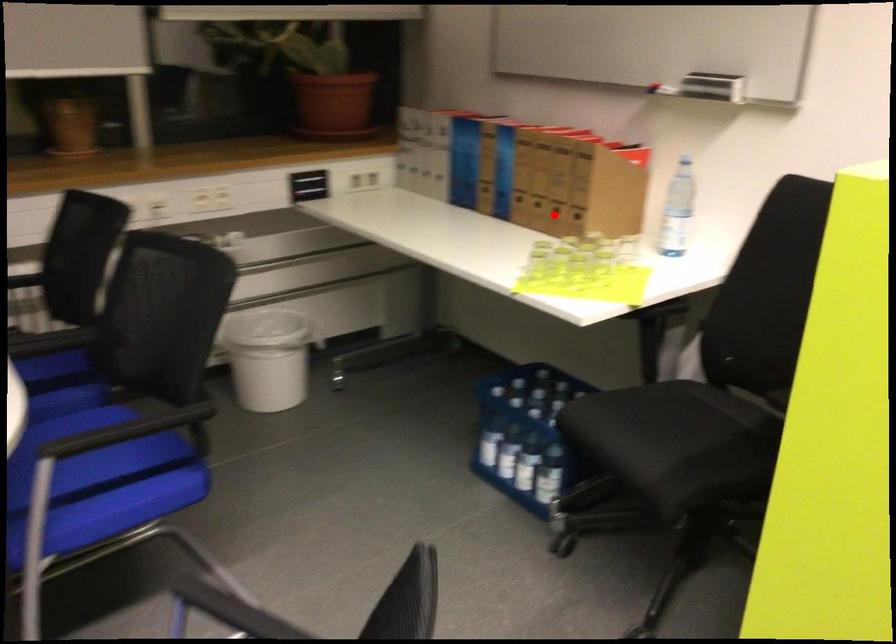
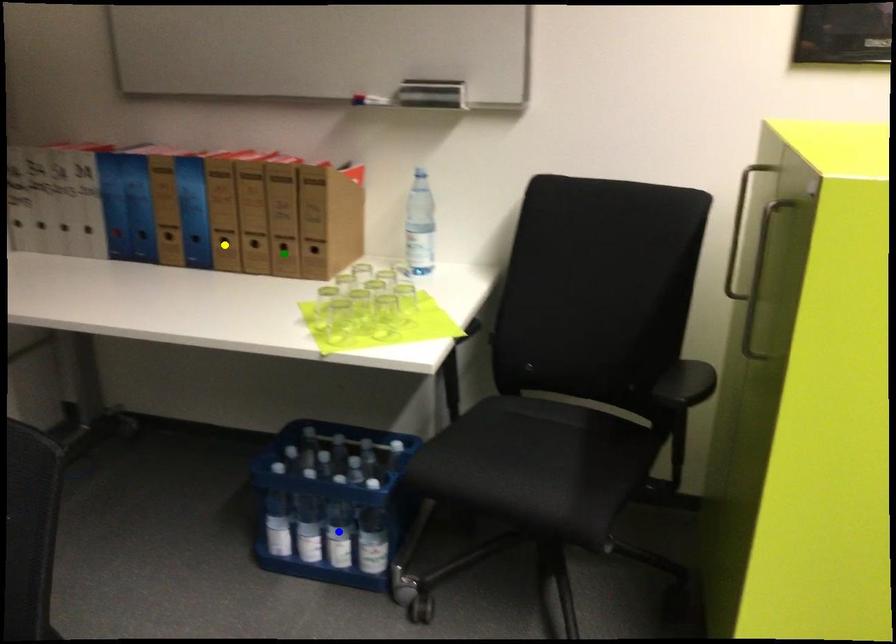
Question: I am providing you with two images of the same scene from different viewpoints. A red point is marked on the first image. You are given multiple points on the second image. Which spot in image 2 lines up with the point in image 1?

Choices:
 (A) green point
 (B) blue point
 (C) yellow point

Answer: (A)